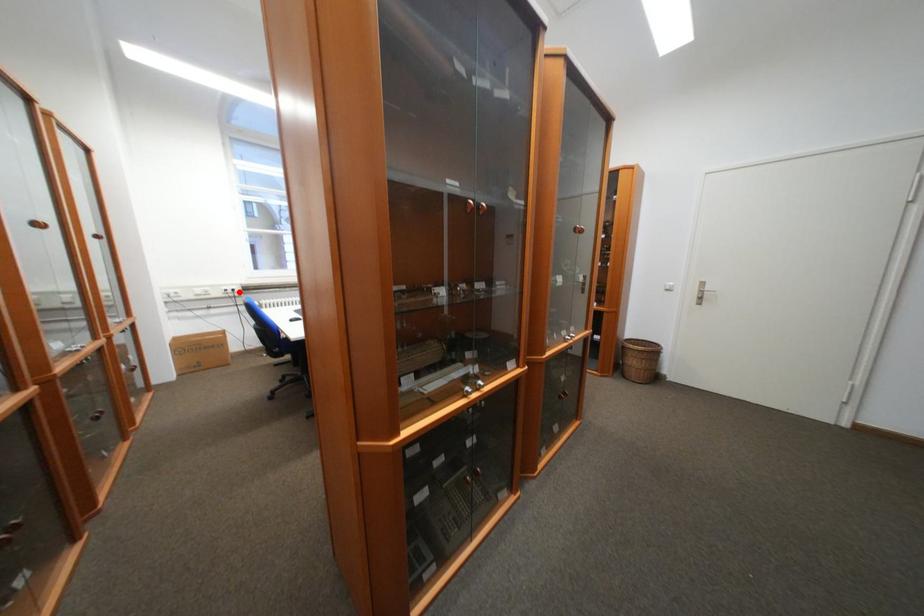
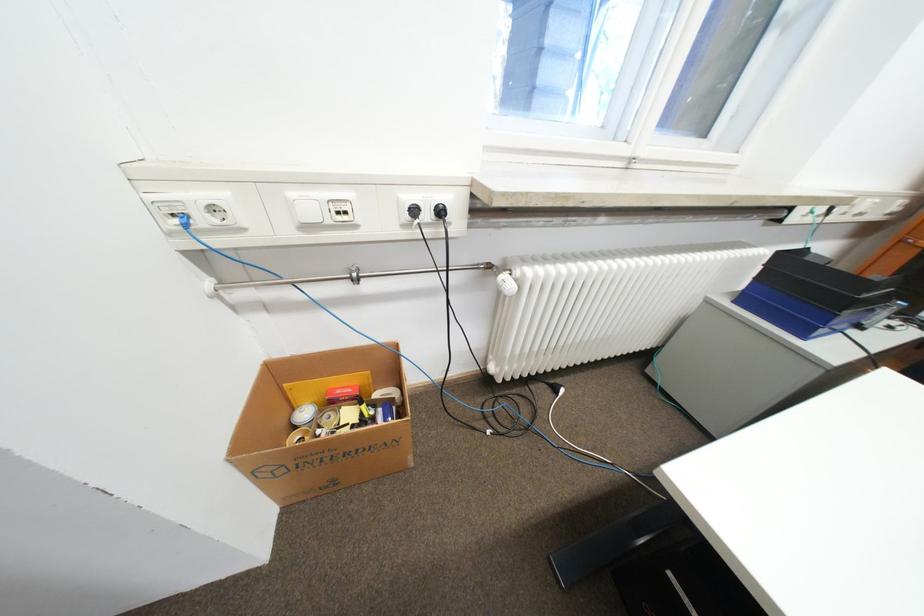
Where in the second image is the point corresponding to the highlighted location from the first image?

(436, 216)